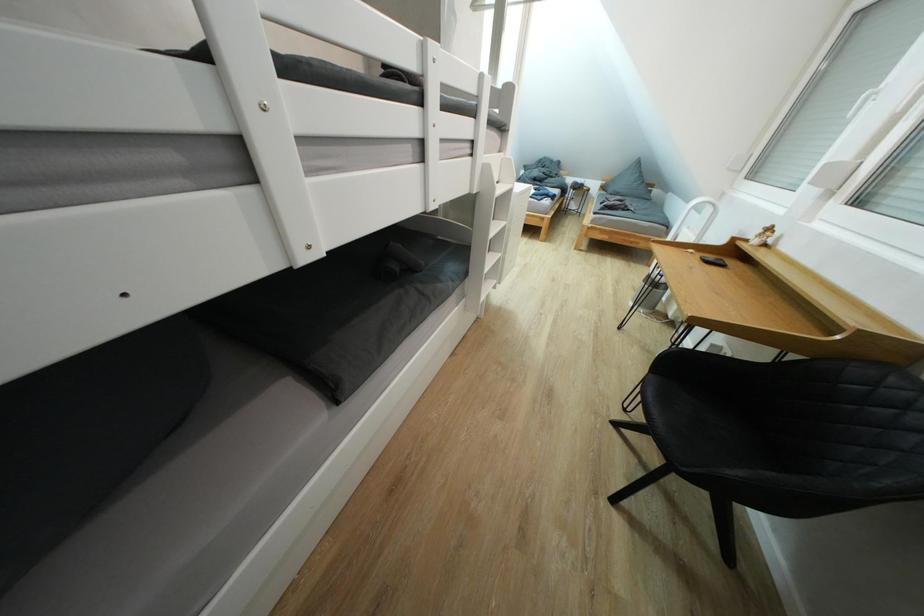
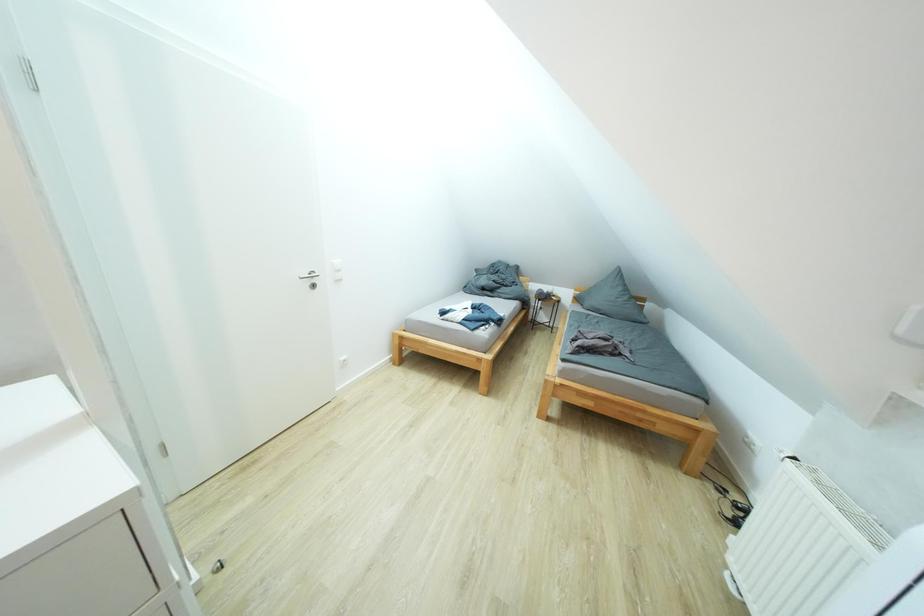
What movement of the cameraman would produce the second image?

The movement direction of the cameraman is right, forward.